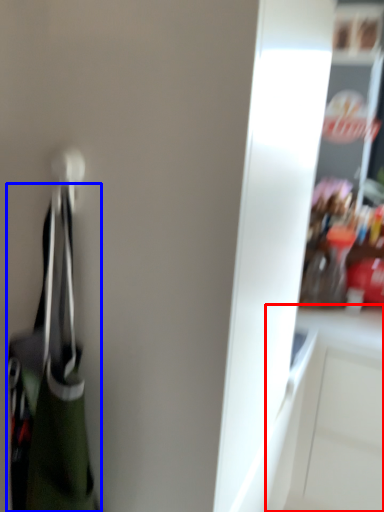
Question: Which object is closer to the camera taking this photo, cabinetry (highlighted by a red box) or handbag (highlighted by a blue box)?

Choices:
 (A) cabinetry
 (B) handbag

Answer: (B)